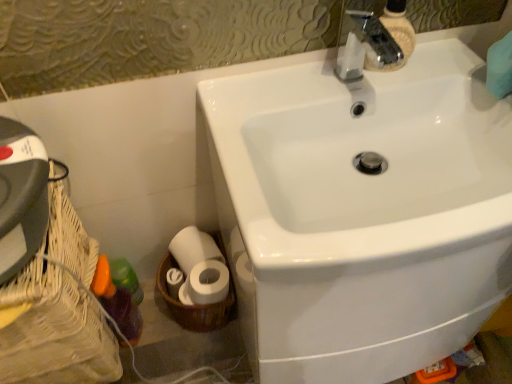
Question: Is the surface of white glossy sink at upper right in direct contact with woven wood basket at lower left, the first basket container when ordered from left to right?

Choices:
 (A) no
 (B) yes

Answer: (A)

Question: Is white glossy sink at upper right shorter than woven wood basket at lower left, which is the second basket container from right to left?

Choices:
 (A) yes
 (B) no

Answer: (B)

Question: Is white glossy sink at upper right bigger than woven wood basket at lower left, which is the second basket container from right to left?

Choices:
 (A) yes
 (B) no

Answer: (A)

Question: Is white glossy sink at upper right at the right side of woven wood basket at lower left, the first basket container when ordered from left to right?

Choices:
 (A) no
 (B) yes

Answer: (B)

Question: Is the position of white glossy sink at upper right more distant than that of woven wood basket at lower left, which is the second basket container from right to left?

Choices:
 (A) no
 (B) yes

Answer: (A)

Question: Do you think white glossy sink at upper right is within woven wood basket at lower left, the first basket container when ordered from left to right, or outside of it?

Choices:
 (A) outside
 (B) inside

Answer: (A)

Question: From the image's perspective, is white glossy sink at upper right located above or below woven wood basket at lower left, which is the second basket container from right to left?

Choices:
 (A) above
 (B) below

Answer: (A)

Question: From their relative heights in the image, would you say white glossy sink at upper right is taller or shorter than woven wood basket at lower left, which is the second basket container from right to left?

Choices:
 (A) short
 (B) tall

Answer: (B)

Question: Is point (220, 81) closer or farther from the camera than point (53, 336)?

Choices:
 (A) farther
 (B) closer

Answer: (A)

Question: In terms of width, does translucent plastic bottle at lower left look wider or thinner when compared to white woven basket at lower left, which ranks as the 1th basket container in right-to-left order?

Choices:
 (A) wide
 (B) thin

Answer: (B)

Question: Based on their sizes in the image, would you say translucent plastic bottle at lower left is bigger or smaller than white woven basket at lower left, which appears as the second basket container when viewed from the left?

Choices:
 (A) big
 (B) small

Answer: (B)

Question: Based on their positions, is translucent plastic bottle at lower left located to the left or right of white woven basket at lower left, which ranks as the 1th basket container in right-to-left order?

Choices:
 (A) right
 (B) left

Answer: (B)

Question: Is translucent plastic bottle at lower left situated inside white woven basket at lower left, which ranks as the 1th basket container in right-to-left order, or outside?

Choices:
 (A) inside
 (B) outside

Answer: (B)

Question: Visually, is translucent plastic bottle at lower left positioned to the left or to the right of white glossy sink at upper right?

Choices:
 (A) right
 (B) left

Answer: (B)

Question: Is point (139, 327) positioned closer to the camera than point (295, 306)?

Choices:
 (A) farther
 (B) closer

Answer: (A)